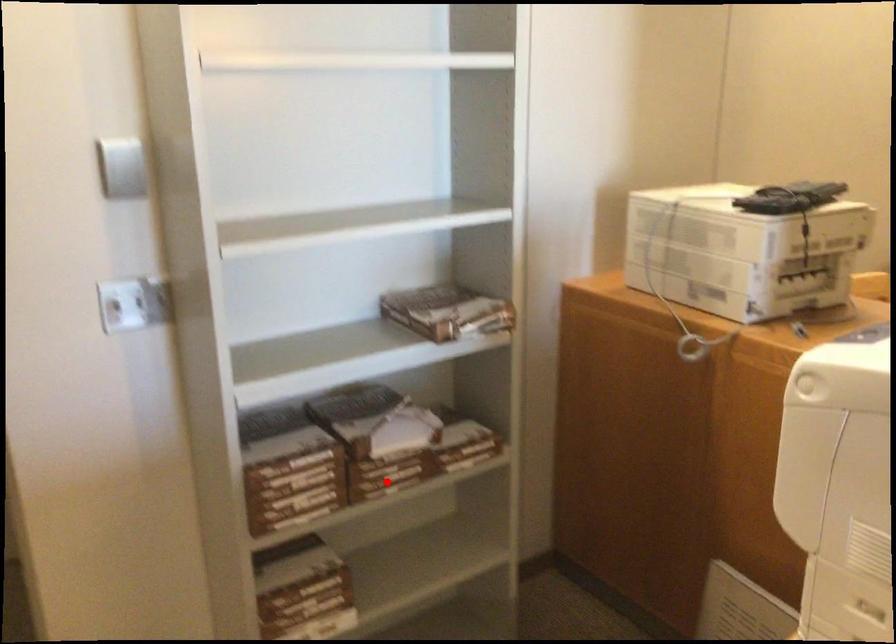
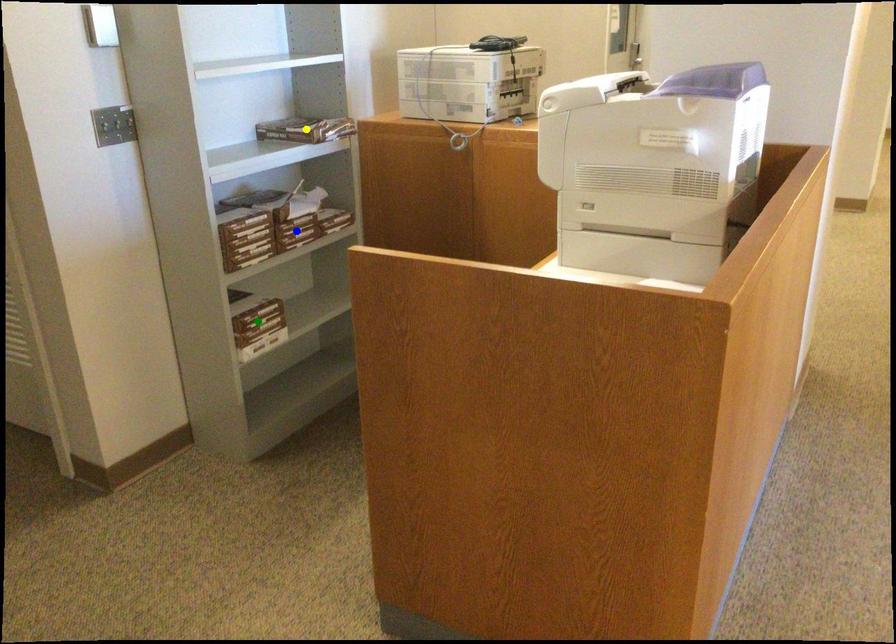
Question: I am providing you with two images of the same scene from different viewpoints. A red point is marked on the first image. You are given multiple points on the second image. Which spot in image 2 lines up with the point in image 1?

Choices:
 (A) yellow point
 (B) blue point
 (C) green point

Answer: (B)